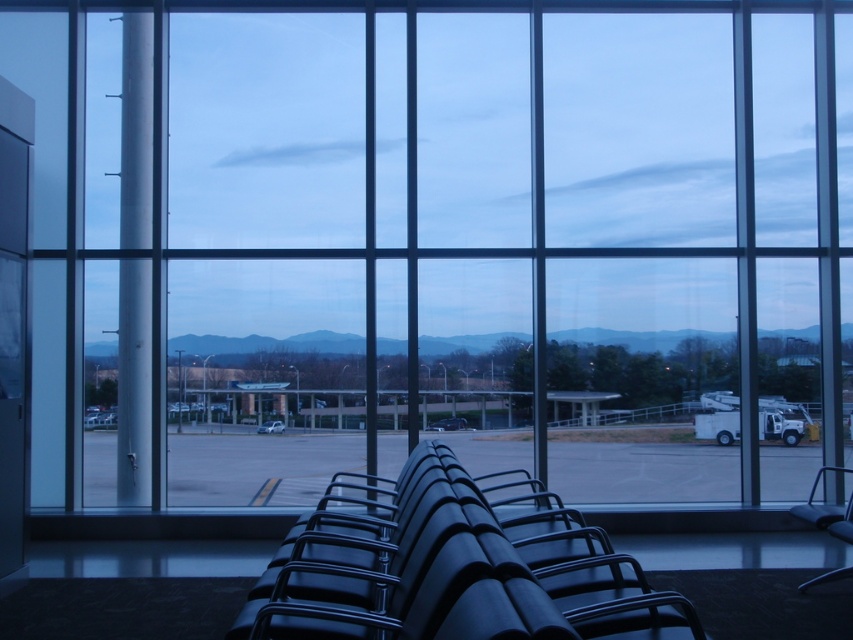
Does matte black chair at center lie in front of smooth concrete runway at center?

Yes, matte black chair at center is closer to the viewer.

You are a GUI agent. You are given a task and a screenshot of the screen. Output one action in this format:
    pyautogui.click(x=<x>, y=<y>)
    Task: Click on the matte black chair at center
    This screenshot has width=853, height=640.
    Given the screenshot: What is the action you would take?
    pyautogui.click(x=451, y=570)

Does point (486, 490) come in front of point (201, 464)?

Yes, point (486, 490) is closer to viewer.

Find the location of a particular element. The image size is (853, 640). matte black chair at center is located at coordinates (451, 570).